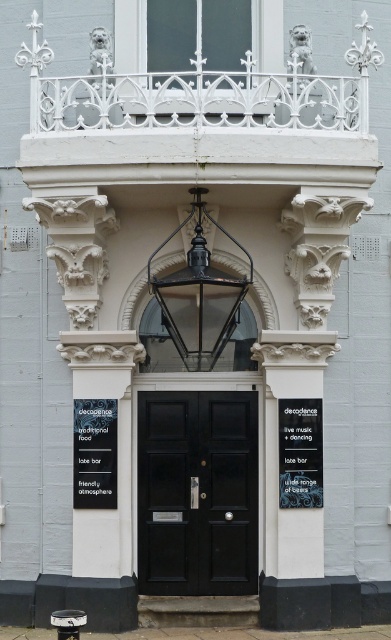
Question: Which of the following is the farthest from the observer?

Choices:
 (A) (150, 396)
 (B) (87, 436)
 (C) (308, 442)

Answer: (A)

Question: Can you confirm if black matte door at center is positioned below black matte signboard at center?

Choices:
 (A) yes
 (B) no

Answer: (A)

Question: Is black matte door at center in front of black paper at lower left?

Choices:
 (A) no
 (B) yes

Answer: (A)

Question: Which of the following is the farthest from the observer?

Choices:
 (A) (319, 481)
 (B) (249, 461)
 (C) (80, 464)

Answer: (B)

Question: Among these points, which one is nearest to the camera?

Choices:
 (A) (75, 460)
 (B) (304, 499)

Answer: (B)

Question: Is black matte signboard at center further to camera compared to black paper at lower left?

Choices:
 (A) yes
 (B) no

Answer: (B)